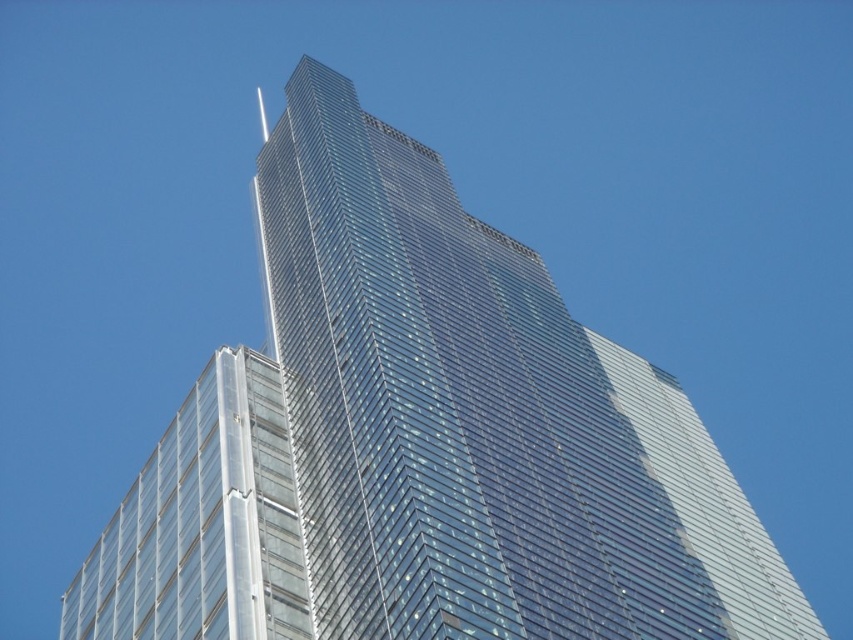
You are an architect evaluating the design of the skyscraper. From your vantage point below, which of the two transparent structures, the transparent glass tower at center or the transparent glass building at lower left, appears closer to you?

The transparent glass building at lower left appears closer because it is larger in size compared to the transparent glass tower at center, which is smaller and therefore farther away.

You are standing at the base of the transparent glass tower at center. Looking up, you notice a point marked at coordinates (480, 420). Is this point located on the transparent glass tower at center?

The transparent glass tower at center is located at point (480, 420), so yes, the point marked at those coordinates is indeed on the transparent glass tower at center.